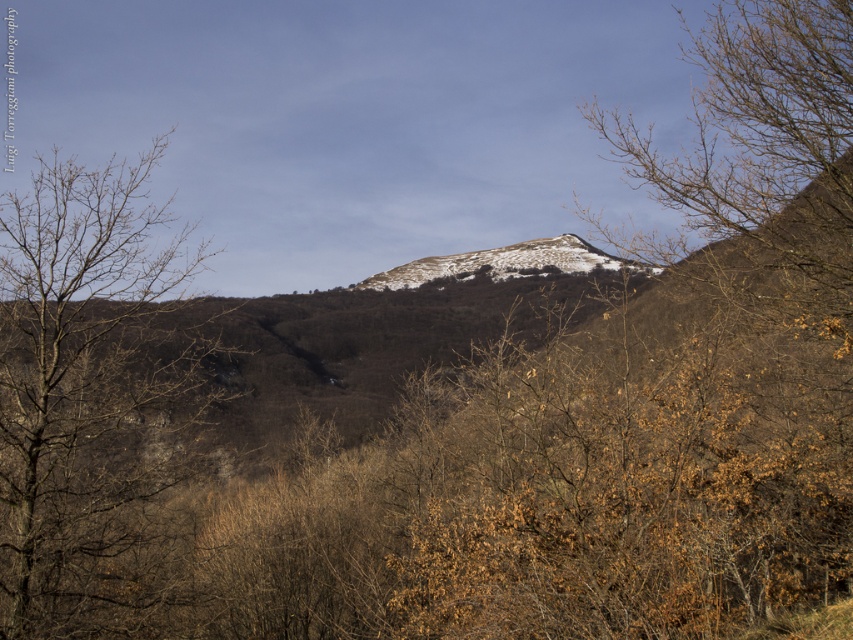
Question: Among these objects, which one is nearest to the camera?

Choices:
 (A) brown leafless branches at upper right
 (B) white powdery snow at center
 (C) bare branches at left

Answer: (C)

Question: Which point is closer to the camera?

Choices:
 (A) (738, 160)
 (B) (26, 403)

Answer: (B)

Question: Does brown leafless branches at upper right appear on the left side of white powdery snow at center?

Choices:
 (A) no
 (B) yes

Answer: (A)

Question: Does bare branches at left come in front of brown leafless branches at upper right?

Choices:
 (A) yes
 (B) no

Answer: (A)

Question: Where is brown leafless branches at upper right located in relation to white powdery snow at center in the image?

Choices:
 (A) above
 (B) below

Answer: (A)

Question: Which point is farther to the camera?

Choices:
 (A) (82, 500)
 (B) (556, 252)
 (C) (704, 116)

Answer: (B)